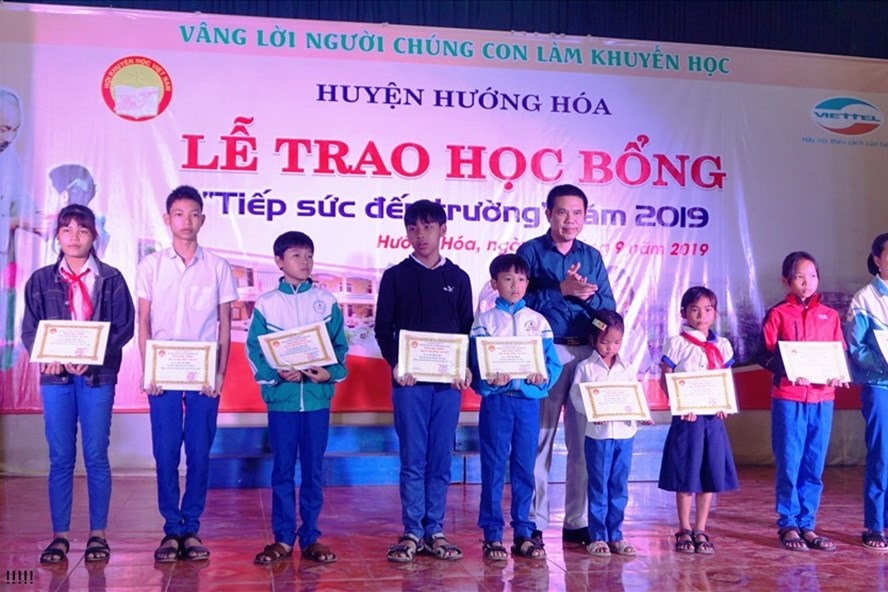
Where is `certificates`? certificates is located at coordinates (76, 337), (187, 371), (310, 350), (421, 366), (508, 362), (613, 411), (700, 408), (803, 369), (882, 353).